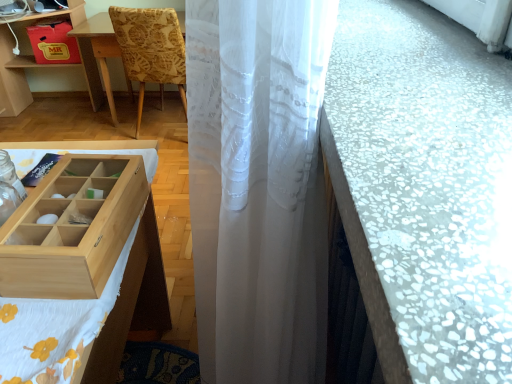
Find the location of a particular element. Image resolution: width=512 pixels, height=384 pixels. vacant space in wooden table at left (from a real-world perspective) is located at coordinates (39, 119).